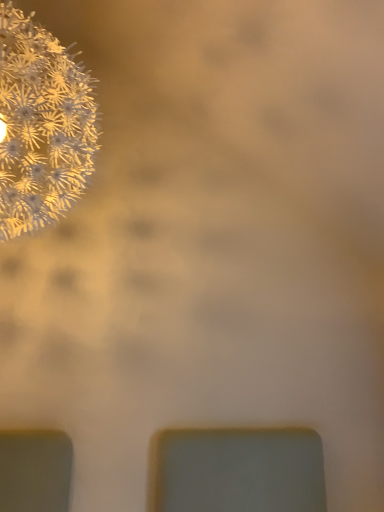
At what (x,y) coordinates should I click in order to perform the action: click on white fluffy flower at upper left. Please return your answer as a coordinate pair (x, y). The height and width of the screenshot is (512, 384). Looking at the image, I should click on (41, 126).

Measure the distance between point (79, 191) and camera.

They are 1.77 meters apart.

What do you see at coordinates (41, 126) in the screenshot? This screenshot has width=384, height=512. I see `white fluffy flower at upper left` at bounding box center [41, 126].

Measure the distance between white fluffy flower at upper left and camera.

The distance of white fluffy flower at upper left from camera is 1.29 meters.

Identify the location of white fluffy flower at upper left. (41, 126).